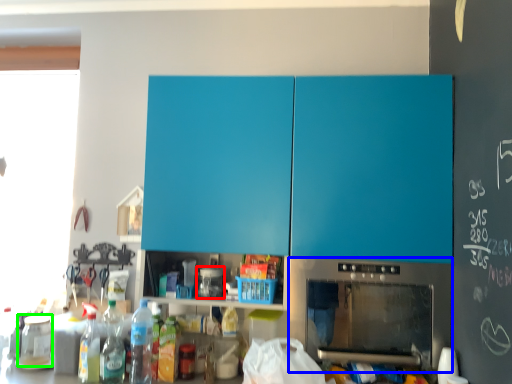
Question: Which object is positioned farthest from appliance (highlighted by a red box)? Select from home appliance (highlighted by a blue box) and appliance (highlighted by a green box).

Choices:
 (A) home appliance
 (B) appliance

Answer: (B)